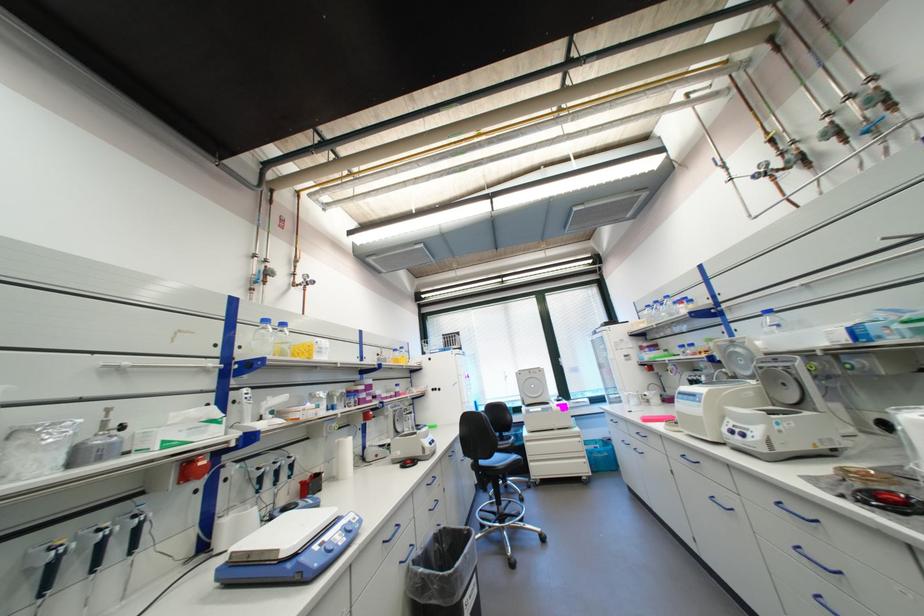
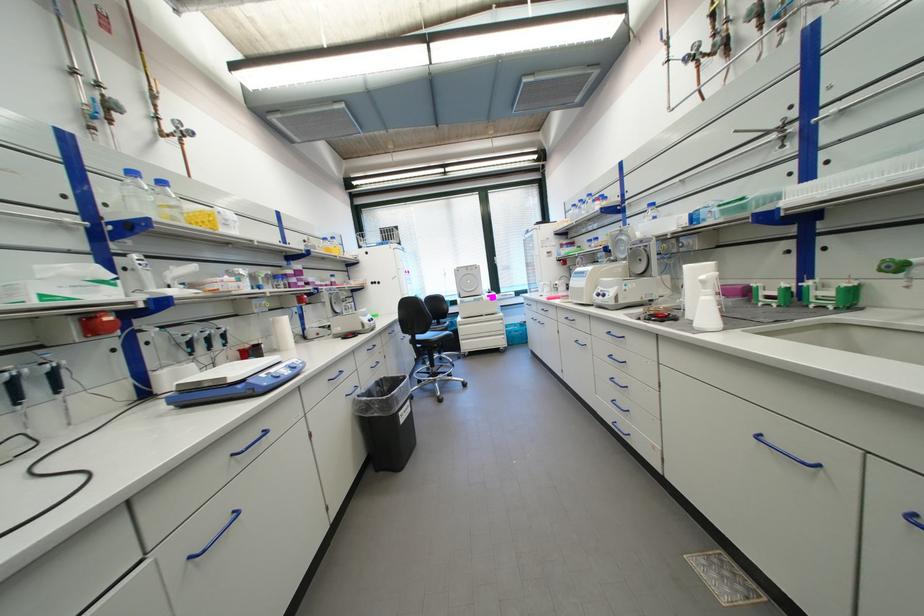
The point at (527, 374) is marked in the first image. Where is the corresponding point in the second image?

(466, 272)